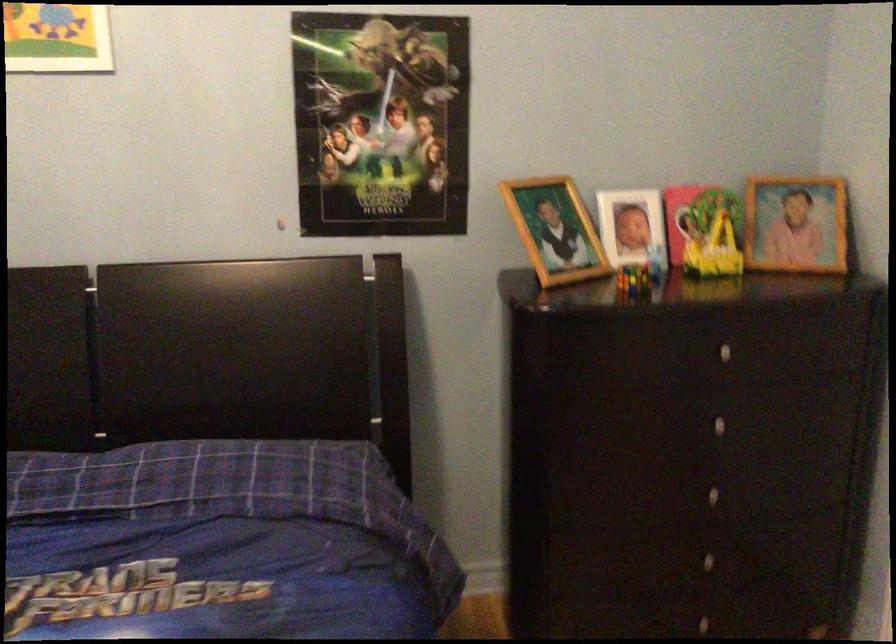
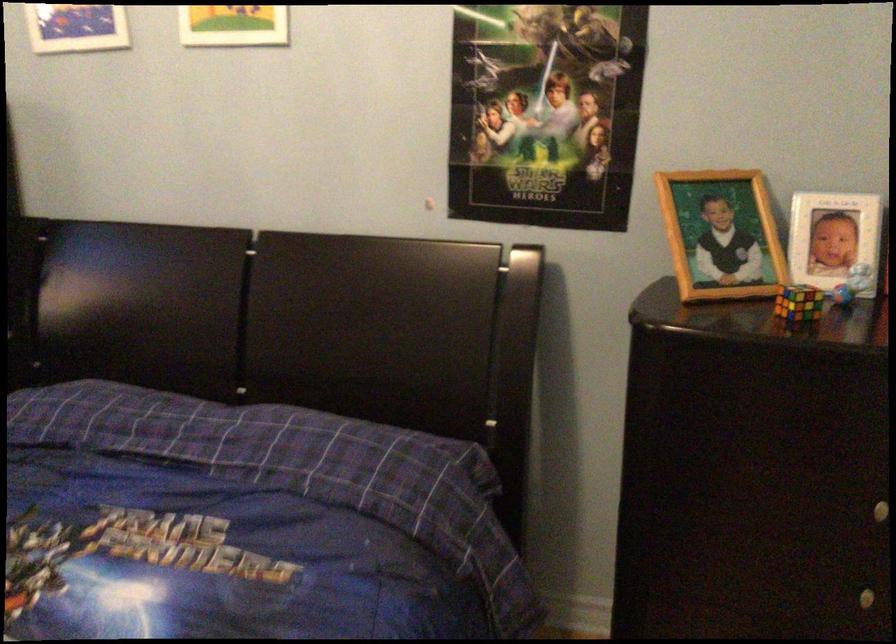
In the second image, find the point that corresponds to pixel 718 491 in the first image.

(868, 597)